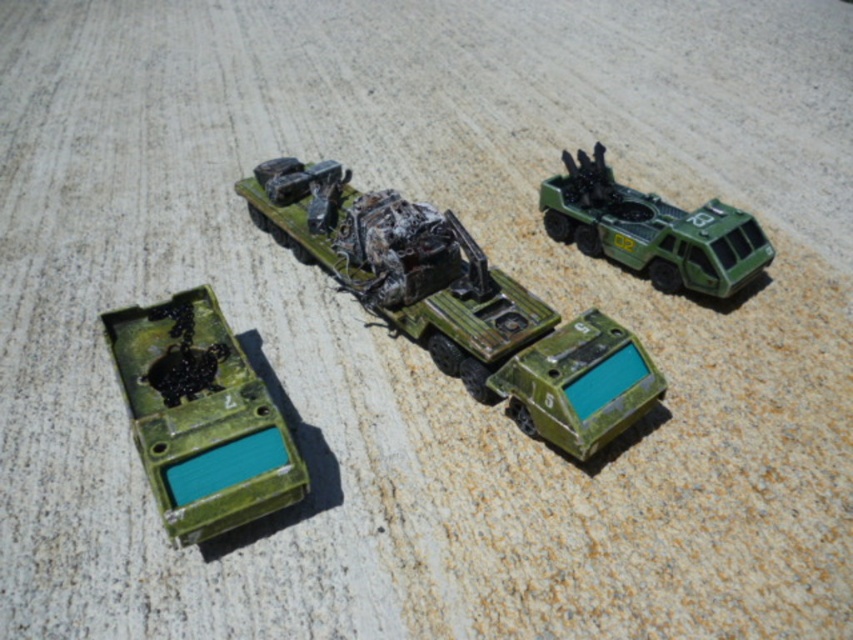
What do you see at coordinates (201, 417) in the screenshot? The width and height of the screenshot is (853, 640). I see `matte green plastic at lower left` at bounding box center [201, 417].

Who is positioned more to the left, matte green plastic at lower left or green matte military vehicle at upper right?

From the viewer's perspective, matte green plastic at lower left appears more on the left side.

Describe the element at coordinates (201, 417) in the screenshot. This screenshot has height=640, width=853. I see `matte green plastic at lower left` at that location.

The image size is (853, 640). I want to click on matte green plastic at lower left, so click(x=201, y=417).

Which of these two, green matte military vehicle at upper right or matte green plastic tank at lower center, stands shorter?

Standing shorter between the two is matte green plastic tank at lower center.

Can you confirm if green matte military vehicle at upper right is taller than matte green plastic tank at lower center?

Indeed, green matte military vehicle at upper right has a greater height compared to matte green plastic tank at lower center.

Does point (694, 269) come behind point (544, 369)?

Yes, point (694, 269) is farther from viewer.

Locate an element on the screen. green matte military vehicle at upper right is located at coordinates (653, 230).

The height and width of the screenshot is (640, 853). In order to click on matte green plastic at lower left in this screenshot , I will do `click(201, 417)`.

Does point (236, 522) come behind point (648, 360)?

No, it is in front of (648, 360).

Who is more forward, (184, 541) or (622, 408)?

Point (184, 541)

Where is `matte green plastic at lower left`? matte green plastic at lower left is located at coordinates (201, 417).